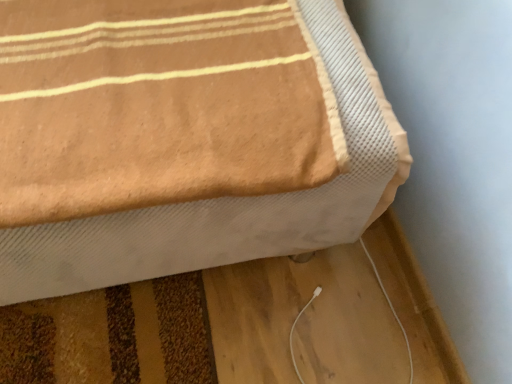
In order to click on beige fabric bed at upper left in this screenshot , I will do `click(183, 139)`.

This screenshot has height=384, width=512. Describe the element at coordinates (183, 139) in the screenshot. I see `beige fabric bed at upper left` at that location.

At what (x,y) coordinates should I click in order to perform the action: click on beige fabric bed at upper left. Please return your answer as a coordinate pair (x, y). This screenshot has height=384, width=512. Looking at the image, I should click on (183, 139).